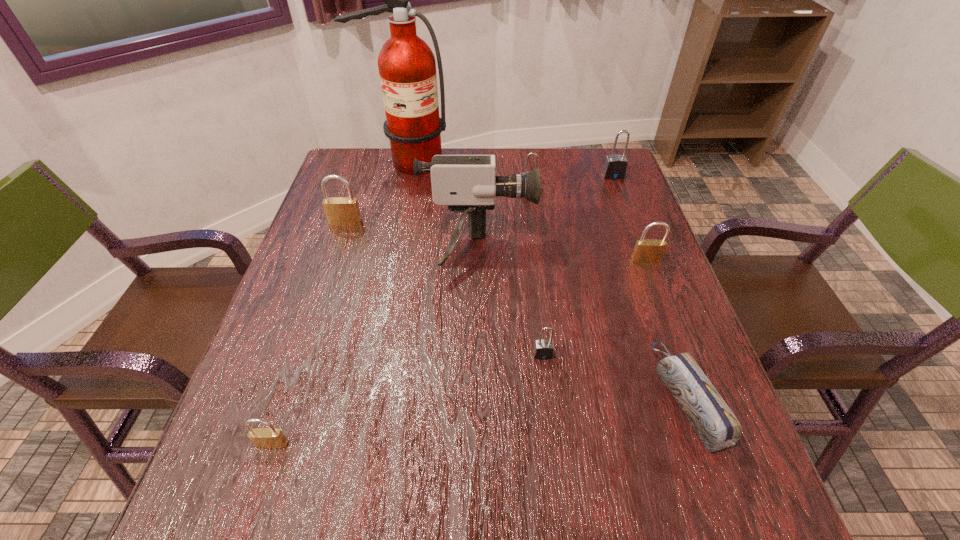
The image size is (960, 540). I want to click on fire extinguisher, so click(x=407, y=67).

I want to click on white camcorder, so click(x=466, y=183).

Locate an element on the screen. the second tallest object is located at coordinates (466, 183).

I want to click on the rightmost gray padlock, so click(x=615, y=166).

Find the location of a particular element. The image size is (960, 540). the farthest gray padlock is located at coordinates (615, 166).

Where is `the biggest brass padlock`? the biggest brass padlock is located at coordinates (340, 211).

Where is `the fourth nearest padlock`? This screenshot has width=960, height=540. the fourth nearest padlock is located at coordinates (340, 211).

The width and height of the screenshot is (960, 540). What are the coordinates of `the second biggest gray padlock` in the screenshot? It's located at (529, 154).

This screenshot has height=540, width=960. I want to click on the second farthest gray padlock, so click(529, 154).

At what (x,y) coordinates should I click in order to perform the action: click on the third nearest padlock. Please return your answer as a coordinate pair (x, y). Image resolution: width=960 pixels, height=540 pixels. Looking at the image, I should click on (646, 250).